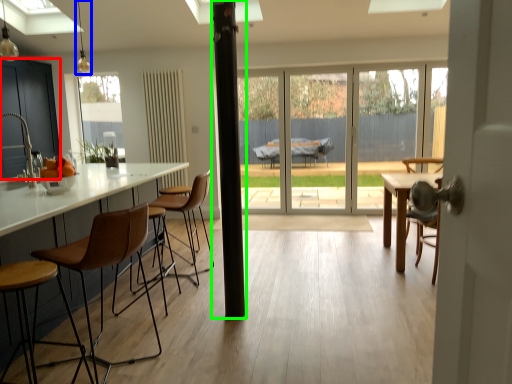
Question: Which object is the closest to the cabinetry (highlighted by a red box)? Choose among these: light fixture (highlighted by a blue box) or pillar (highlighted by a green box).

Choices:
 (A) light fixture
 (B) pillar

Answer: (A)